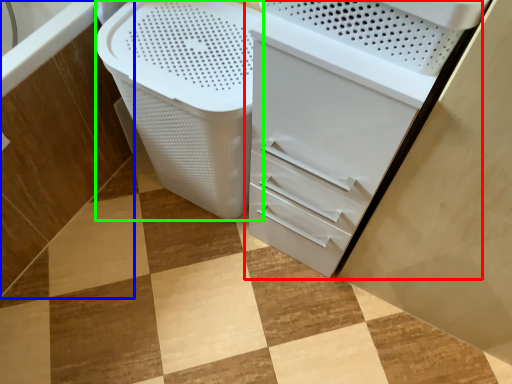
Question: Based on their relative distances, which object is farther from file cabinet (highlighted by a red box)? Choose from bath (highlighted by a blue box) and laundry basket (highlighted by a green box).

Choices:
 (A) bath
 (B) laundry basket

Answer: (A)